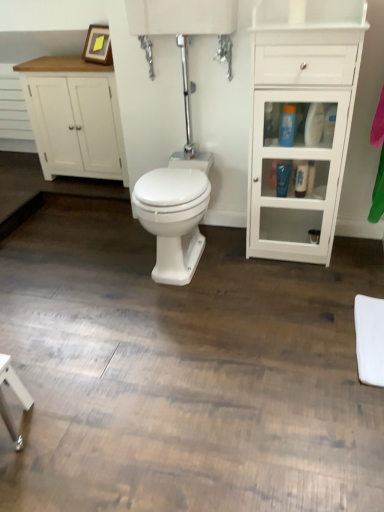
Question: Can you confirm if white glossy bidet at center is smaller than white wood cabinet at left, which is the first bathroom cabinet from back to front?

Choices:
 (A) yes
 (B) no

Answer: (A)

Question: Is white glossy bidet at center turned away from white wood cabinet at left, which appears as the 2th bathroom cabinet when viewed from the right?

Choices:
 (A) no
 (B) yes

Answer: (A)

Question: From the image's perspective, is white glossy bidet at center on top of white wood cabinet at left, which appears as the 2th bathroom cabinet when viewed from the right?

Choices:
 (A) no
 (B) yes

Answer: (A)

Question: From a real-world perspective, is white glossy bidet at center positioned under white wood cabinet at left, which appears as the 2th bathroom cabinet when viewed from the right, based on gravity?

Choices:
 (A) no
 (B) yes

Answer: (B)

Question: Could you tell me if white glossy bidet at center is facing white wood cabinet at left, which appears as the 2th bathroom cabinet when viewed from the right?

Choices:
 (A) no
 (B) yes

Answer: (A)

Question: Is white glossy bidet at center behind white wood cabinet at left, which is the first bathroom cabinet from back to front?

Choices:
 (A) no
 (B) yes

Answer: (A)

Question: Is blue glossy lotion at center right, which appears as the second toiletry when viewed from the top, smaller than wooden picture frame at upper left?

Choices:
 (A) no
 (B) yes

Answer: (B)

Question: Is blue glossy lotion at center right, which appears as the second toiletry when viewed from the top, in front of wooden picture frame at upper left?

Choices:
 (A) no
 (B) yes

Answer: (B)

Question: From the image's perspective, is blue glossy lotion at center right, which appears as the second toiletry when viewed from the top, on top of wooden picture frame at upper left?

Choices:
 (A) no
 (B) yes

Answer: (A)

Question: Is blue glossy lotion at center right, which appears as the second toiletry when viewed from the top, at the left side of wooden picture frame at upper left?

Choices:
 (A) no
 (B) yes

Answer: (A)

Question: Is blue glossy lotion at center right, which appears as the second toiletry when viewed from the top, not within wooden picture frame at upper left?

Choices:
 (A) yes
 (B) no

Answer: (A)

Question: From a real-world perspective, does blue glossy lotion at center right, which appears as the second toiletry when viewed from the top, stand above wooden picture frame at upper left?

Choices:
 (A) yes
 (B) no

Answer: (B)

Question: Is white glossy bottle at right, which ranks as the 3th toiletry in top-to-bottom order, a part of white glossy cabinet at right, the 2th bathroom cabinet in the left-to-right sequence?

Choices:
 (A) yes
 (B) no

Answer: (A)